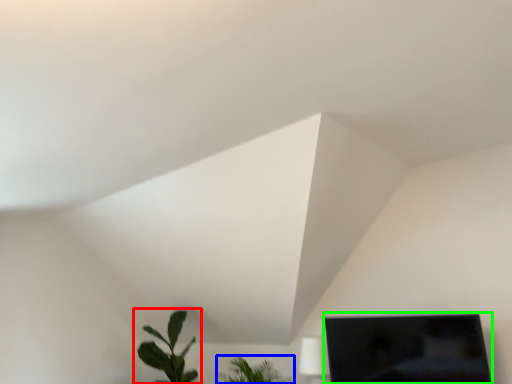
Question: Based on their relative distances, which object is nearer to houseplant (highlighted by a red box)? Choose from houseplant (highlighted by a blue box) and computer monitor (highlighted by a green box).

Choices:
 (A) houseplant
 (B) computer monitor

Answer: (A)